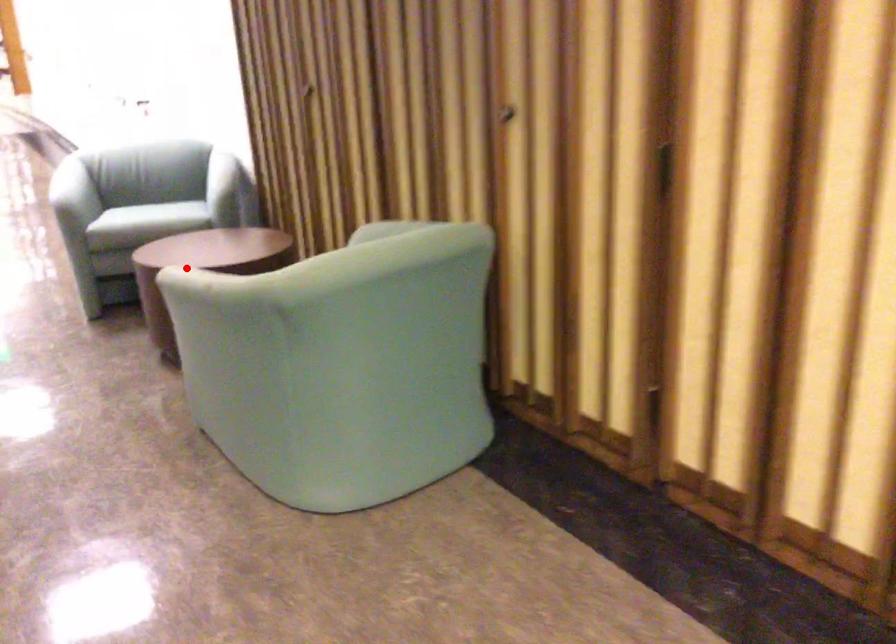
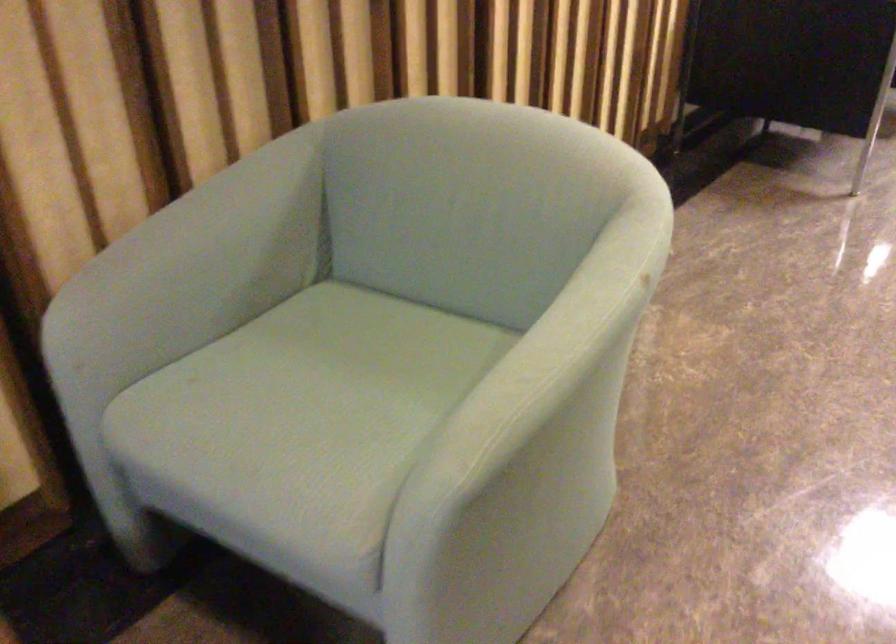
Question: I am providing you with two images of the same scene from different viewpoints. Image1 has a red point marked. In image2, the corresponding 3D location appears at what relative position? Reply with the corresponding letter.

Choices:
 (A) Closer
 (B) Farther

Answer: (A)